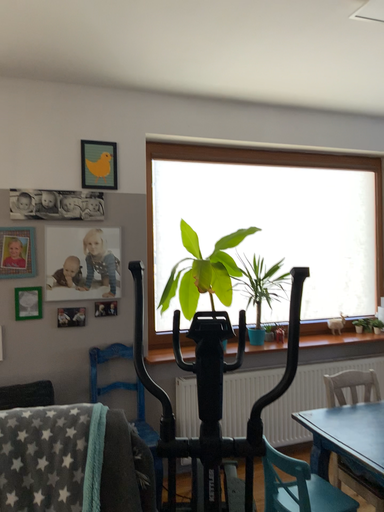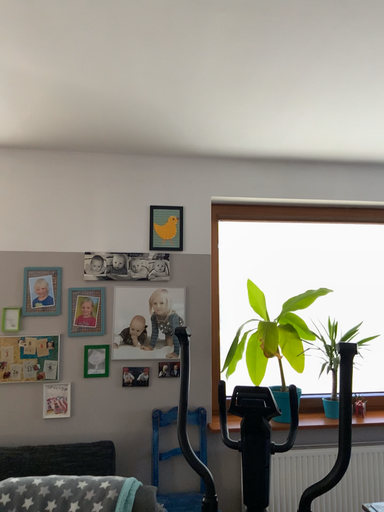
Question: Which way did the camera rotate in the video?

Choices:
 (A) rotated right
 (B) rotated left

Answer: (B)